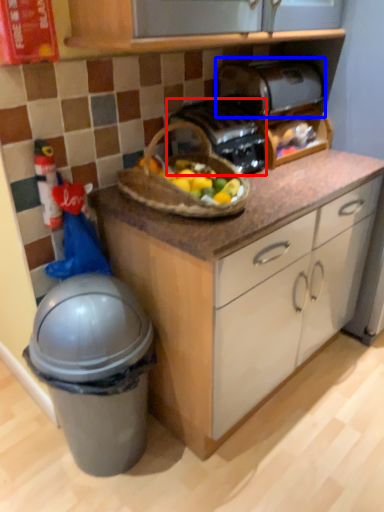
Question: Which of the following is the closest to the observer, toaster (highlighted by a red box) or toaster (highlighted by a blue box)?

Choices:
 (A) toaster
 (B) toaster

Answer: (A)